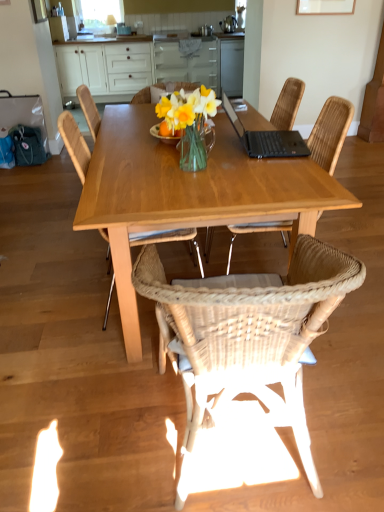
Find the location of a particular element. This screenshot has width=384, height=512. vacant area situated to the left side of woven wood chair at center, positioned as the first chair in left-to-right order is located at coordinates (51, 308).